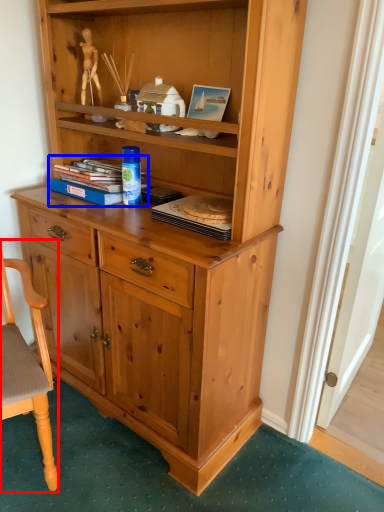
Question: Among these objects, which one is farthest to the camera, chair (highlighted by a red box) or book (highlighted by a blue box)?

Choices:
 (A) chair
 (B) book

Answer: (B)